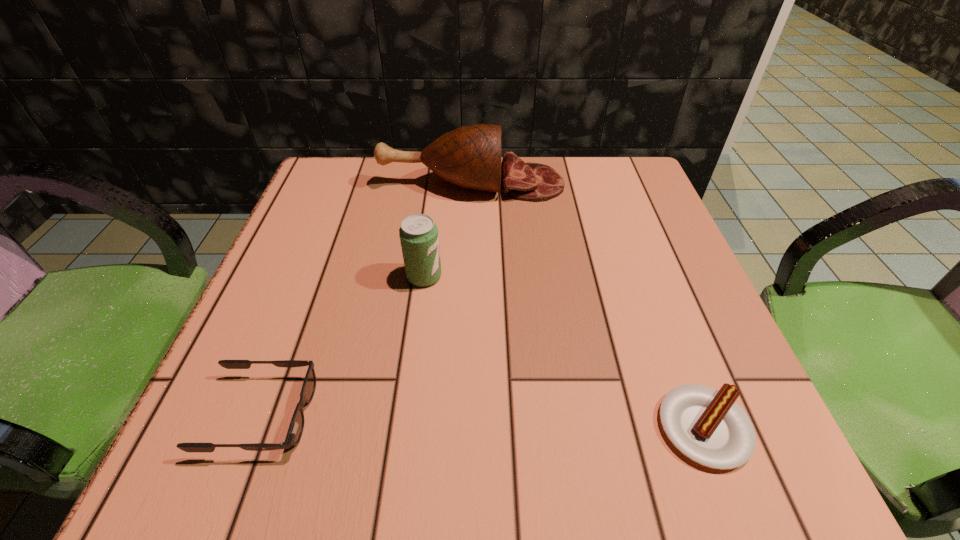
Where is `ham`? ham is located at coordinates (470, 156).

Find the location of `soda`. soda is located at coordinates (418, 233).

Locate an element on the screen. The image size is (960, 540). the second shortest object is located at coordinates (295, 430).

Where is `sunglasses`? The image size is (960, 540). sunglasses is located at coordinates (295, 430).

Find the location of a particular element. The image size is (960, 540). the rightmost object is located at coordinates (706, 425).

Where is `the shortest object`? the shortest object is located at coordinates (706, 425).

Locate an element on the screen. free region located at the sliced end of the farthest object is located at coordinates [632, 184].

Identify the location of vacant space located on the back of the third nearest object. The width and height of the screenshot is (960, 540). (435, 194).

You are a GUI agent. You are given a task and a screenshot of the screen. Output one action in this format:
    pyautogui.click(x=<x>, y=<y>)
    Task: Click on the vacant space located on the temples of the third tallest object
    The width and height of the screenshot is (960, 540).
    Given the screenshot: What is the action you would take?
    (x=433, y=414)

In order to click on free spot located on the back of the sausage in this screenshot , I will do `click(626, 221)`.